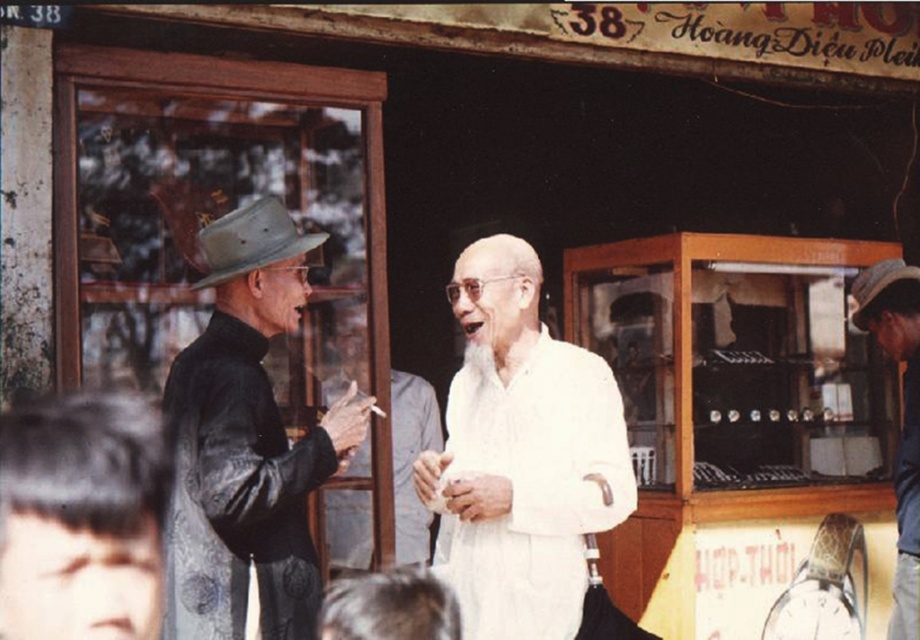
You are standing in the street scene and want to know which of the two points, point (553, 509) or point (907, 486), is closer to you. Can you determine this based on the image?

Point (553, 509) is closer to the camera than point (907, 486), so it is closer to you.

You are a tailor measuring hats for customers. You have two hats in front of you, the dark gray felt hat at left and the brown leather cowboy hat at left. Which hat requires a wider headband to fit properly?

The dark gray felt hat at left requires a wider headband since its width is larger than the brown leather cowboy hat at left.

You are a customer standing at the entrance of the shop. You see the white matte soft fabric at center located at point (521, 454). If you walk straight towards the shop entrance, will you walk directly into the white matte soft fabric at center?

The white matte soft fabric at center is located at point (521, 454). Since you are walking straight towards the shop entrance, you will be moving away from the white matte soft fabric at center, so you will not walk directly into it.